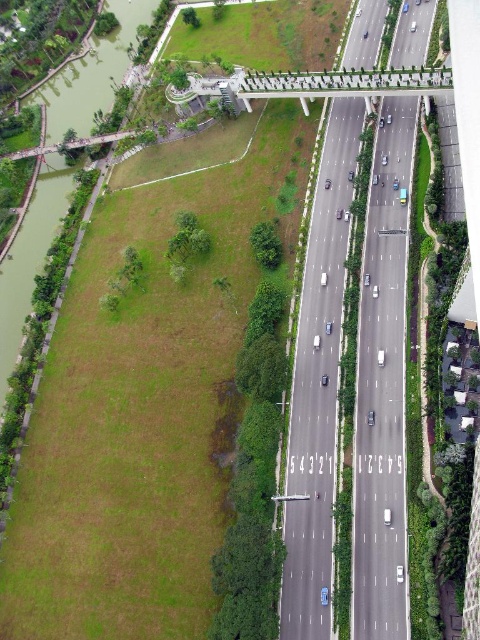
This screenshot has width=480, height=640. In order to click on asphalt road at center in this screenshot , I will do `click(317, 384)`.